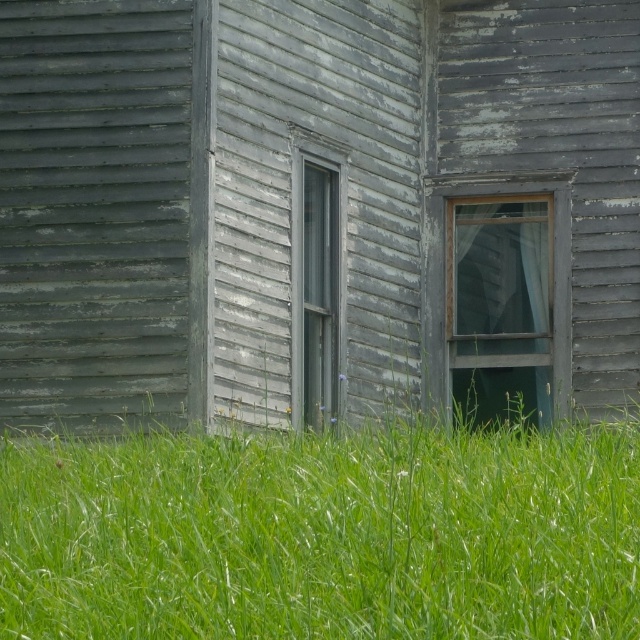
You are standing 10 meters away from a point marked at coordinates point (x=305, y=298). If you walk straight towards the point, how far will you have to walk to reach it?

The point (x=305, y=298) is 15.06 meters away from the camera. Since you are already 10 meters away from the point, you would need to walk an additional 5.06 meters to reach it.

You are an architect assessing the building. You need to determine which window is shorter between the transparent glass window at right and the gray wooden window at center. Which one is shorter?

The transparent glass window at right is shorter than the gray wooden window at center.

You are a painter standing 10 feet away from the weathered gray wood at center and the transparent glass window at right. You want to paint both surfaces but need to know if you can reach them with your 12 inch brush. Can you reach both surfaces with your brush?

Result: The weathered gray wood at center and transparent glass window at right are 22.55 inches apart. Since your brush is 12 inches long, you can reach both surfaces because the distance between them is within the brush length when moving your arm appropriately.